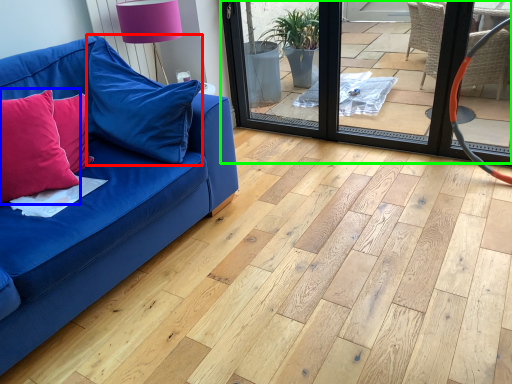
Question: Based on their relative distances, which object is farther from pillow (highlighted by a red box)? Choose from pillow (highlighted by a blue box) and screen door (highlighted by a green box).

Choices:
 (A) pillow
 (B) screen door

Answer: (B)